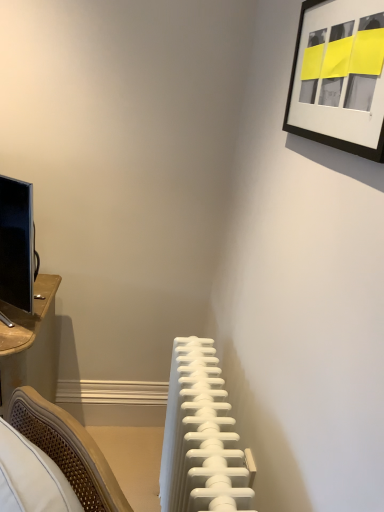
Question: Which is correct: white plastic radiator at center is inside black matte picture frame at upper right, or outside of it?

Choices:
 (A) inside
 (B) outside

Answer: (B)

Question: Based on their positions, is white plastic radiator at center located to the left or right of black matte picture frame at upper right?

Choices:
 (A) right
 (B) left

Answer: (B)

Question: Considering the positions of white plastic radiator at center and black matte picture frame at upper right in the image, is white plastic radiator at center wider or thinner than black matte picture frame at upper right?

Choices:
 (A) thin
 (B) wide

Answer: (B)

Question: Is point (329, 10) closer or farther from the camera than point (226, 394)?

Choices:
 (A) closer
 (B) farther

Answer: (A)

Question: From a real-world perspective, is black matte picture frame at upper right positioned above or below white plastic radiator at center?

Choices:
 (A) above
 (B) below

Answer: (A)

Question: Is black matte picture frame at upper right wider or thinner than white plastic radiator at center?

Choices:
 (A) wide
 (B) thin

Answer: (B)

Question: In the image, is black matte picture frame at upper right positioned in front of or behind white plastic radiator at center?

Choices:
 (A) behind
 (B) front

Answer: (B)